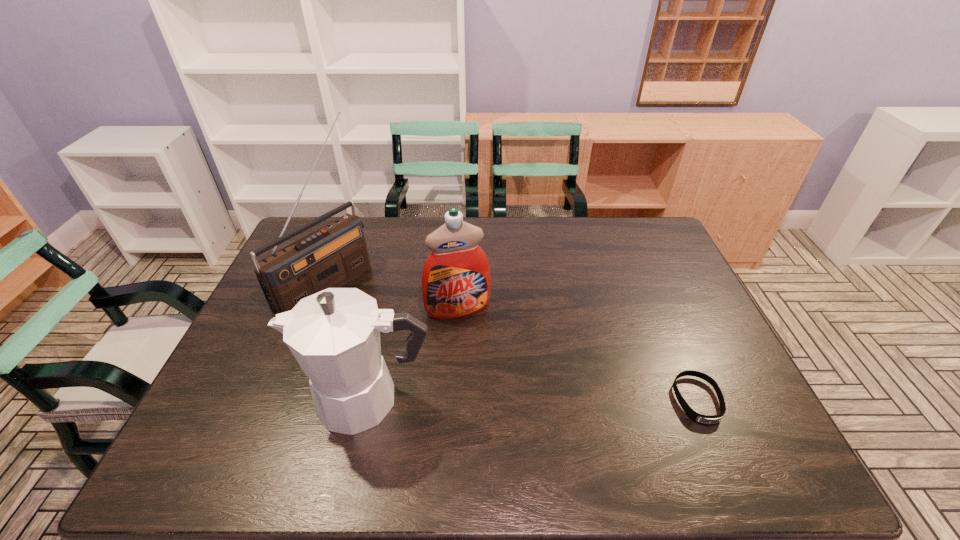
Locate an element on the screen. The image size is (960, 540). vacant area that lies between the tallest object and the rightmost object is located at coordinates (512, 341).

This screenshot has height=540, width=960. What are the coordinates of `the closest object to the wristband` in the screenshot? It's located at (456, 282).

Identify which object is the second nearest to the wristband. Please provide its 2D coordinates. Your answer should be formatted as a tuple, i.e. [(x, y)], where the tuple contains the x and y coordinates of a point satisfying the conditions above.

[(334, 335)]

This screenshot has width=960, height=540. I want to click on vacant space that satisfies the following two spatial constraints: 1. on the front side of the tallest object; 2. at the spout of the coffeepot, so coord(279,400).